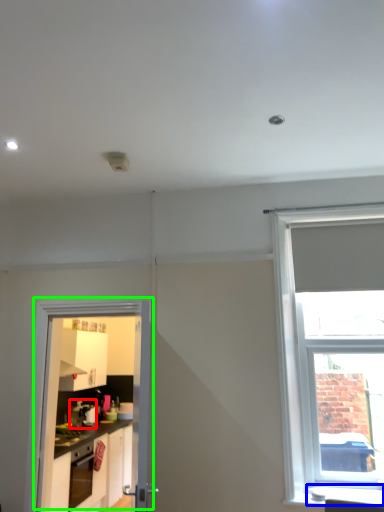
Question: Which is nearer to the coffee machine (highlighted by a red box)? window sill (highlighted by a blue box) or door (highlighted by a green box).

Choices:
 (A) window sill
 (B) door

Answer: (B)